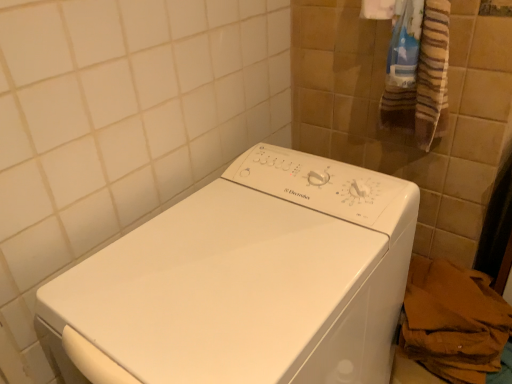
Measure the distance between striped cotton bath towel at upper right and camera.

striped cotton bath towel at upper right and camera are 79.60 centimeters apart.

What is the approximate height of white glossy washing machine at center?

35.43 inches.

Where is `brown paper bag at lower right`? The width and height of the screenshot is (512, 384). brown paper bag at lower right is located at coordinates (453, 322).

Is brown paper bag at lower right facing away from white glossy washing machine at center?

No, brown paper bag at lower right is not facing the opposite direction of white glossy washing machine at center.

Does brown paper bag at lower right come in front of white glossy washing machine at center?

No, it is not.

Is brown paper bag at lower right taller than white glossy washing machine at center?

No.

Is brown paper bag at lower right inside the boundaries of white glossy washing machine at center, or outside?

brown paper bag at lower right is not inside white glossy washing machine at center, it's outside.

From the image's perspective, between brown paper bag at lower right and striped cotton bath towel at upper right, which one is located above?

striped cotton bath towel at upper right, from the image's perspective.

From a real-world perspective, relative to striped cotton bath towel at upper right, is brown paper bag at lower right vertically above or below?

brown paper bag at lower right is below striped cotton bath towel at upper right.

Could you tell me if brown paper bag at lower right is facing striped cotton bath towel at upper right?

No.

At what (x,y) coordinates should I click in order to perform the action: click on material that appears below the striped cotton bath towel at upper right (from the image's perspective). Please return your answer as a coordinate pair (x, y). Looking at the image, I should click on (453, 322).

From the picture: From a real-world perspective, which object stands above the other?

striped cotton bath towel at upper right.

From the image's perspective, which object appears higher, white glossy washing machine at center or striped cotton bath towel at upper right?

striped cotton bath towel at upper right.

Between white glossy washing machine at center and striped cotton bath towel at upper right, which one is positioned behind?

striped cotton bath towel at upper right is behind.

Can you tell me how much white glossy washing machine at center and striped cotton bath towel at upper right differ in facing direction?

0.000676 degrees.

How many degrees apart are the facing directions of white glossy washing machine at center and brown paper bag at lower right?

The facing directions of white glossy washing machine at center and brown paper bag at lower right are 0.000844 degrees apart.

How distant is white glossy washing machine at center from brown paper bag at lower right?

The distance of white glossy washing machine at center from brown paper bag at lower right is 14.46 inches.

In the scene shown: Can you see white glossy washing machine at center touching brown paper bag at lower right?

No, white glossy washing machine at center is not making contact with brown paper bag at lower right.

The width and height of the screenshot is (512, 384). Find the location of `washing machine located in front of the brown paper bag at lower right`. washing machine located in front of the brown paper bag at lower right is located at coordinates (246, 281).

Is striped cotton bath towel at upper right next to brown paper bag at lower right?

No, striped cotton bath towel at upper right is not touching brown paper bag at lower right.

How different are the orientations of striped cotton bath towel at upper right and brown paper bag at lower right in degrees?

0.00146 degrees separate the facing orientations of striped cotton bath towel at upper right and brown paper bag at lower right.

Choose the correct answer: Is striped cotton bath towel at upper right inside brown paper bag at lower right or outside it?

striped cotton bath towel at upper right is outside brown paper bag at lower right.

From the image's perspective, between striped cotton bath towel at upper right and brown paper bag at lower right, who is located below?

brown paper bag at lower right.

Which of these two, striped cotton bath towel at upper right or white glossy washing machine at center, is wider?

white glossy washing machine at center is wider.

Are striped cotton bath towel at upper right and white glossy washing machine at center far apart?

No, striped cotton bath towel at upper right is not far from white glossy washing machine at center.

In the scene shown: Which of these two, striped cotton bath towel at upper right or white glossy washing machine at center, stands taller?

white glossy washing machine at center is taller.

From the image's perspective, is striped cotton bath towel at upper right under white glossy washing machine at center?

No, from the image's perspective, striped cotton bath towel at upper right is not beneath white glossy washing machine at center.

Locate an element on the screen. material located underneath the white glossy washing machine at center (from a real-world perspective) is located at coordinates (453, 322).

Locate an element on the screen. bath towel on the left side of brown paper bag at lower right is located at coordinates (424, 82).

Which object lies further to the anchor point striped cotton bath towel at upper right, white glossy washing machine at center or brown paper bag at lower right?

The object further to striped cotton bath towel at upper right is white glossy washing machine at center.

Looking at the image, which one is located further to white glossy washing machine at center, striped cotton bath towel at upper right or brown paper bag at lower right?

striped cotton bath towel at upper right.

Based on their spatial positions, is white glossy washing machine at center or striped cotton bath towel at upper right closer to brown paper bag at lower right?

white glossy washing machine at center.

Which object lies nearer to the anchor point brown paper bag at lower right, striped cotton bath towel at upper right or white glossy washing machine at center?

Based on the image, white glossy washing machine at center appears to be nearer to brown paper bag at lower right.

From the image, which object appears to be nearer to striped cotton bath towel at upper right, brown paper bag at lower right or white glossy washing machine at center?

brown paper bag at lower right lies closer to striped cotton bath towel at upper right than the other object.

Considering their positions, is brown paper bag at lower right positioned closer to white glossy washing machine at center than striped cotton bath towel at upper right?

Among the two, brown paper bag at lower right is located nearer to white glossy washing machine at center.

Locate an element on the screen. washing machine between striped cotton bath towel at upper right and brown paper bag at lower right in the vertical direction is located at coordinates (246, 281).